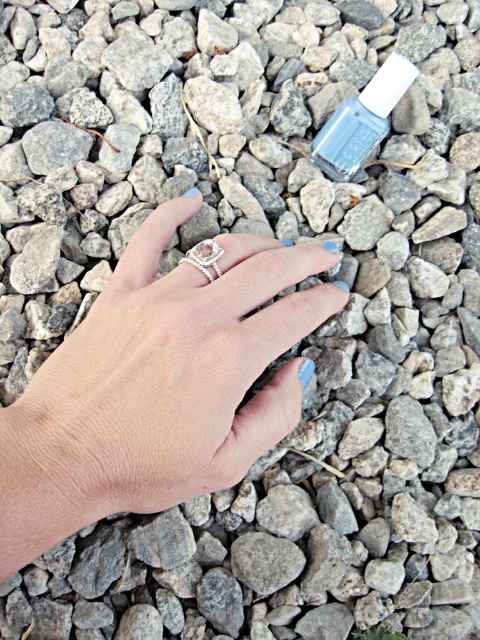
How distant is matte gray nail polish at upper center from silver metallic ring at center?

The distance of matte gray nail polish at upper center from silver metallic ring at center is 7.66 inches.

Does point (372, 131) lie behind point (202, 269)?

Yes, it is behind point (202, 269).

This screenshot has height=640, width=480. What do you see at coordinates (360, 120) in the screenshot?
I see `matte gray nail polish at upper center` at bounding box center [360, 120].

This screenshot has width=480, height=640. I want to click on matte gray nail polish at upper center, so click(x=360, y=120).

Is matte silver ring at center wider than silver metallic ring at center?

Correct, the width of matte silver ring at center exceeds that of silver metallic ring at center.

Does point (179, 320) come closer to viewer compared to point (212, 280)?

That is True.

The height and width of the screenshot is (640, 480). Identify the location of matte silver ring at center. (164, 380).

Is matte silver ring at center positioned behind matte gray nail polish at upper center?

No.

Between point (147, 362) and point (336, 145), which one is positioned in front?

Point (147, 362)

You are a GUI agent. You are given a task and a screenshot of the screen. Output one action in this format:
    pyautogui.click(x=<x>, y=<y>)
    Task: Click on the matte silver ring at center
    This screenshot has width=480, height=640.
    Given the screenshot: What is the action you would take?
    pyautogui.click(x=164, y=380)